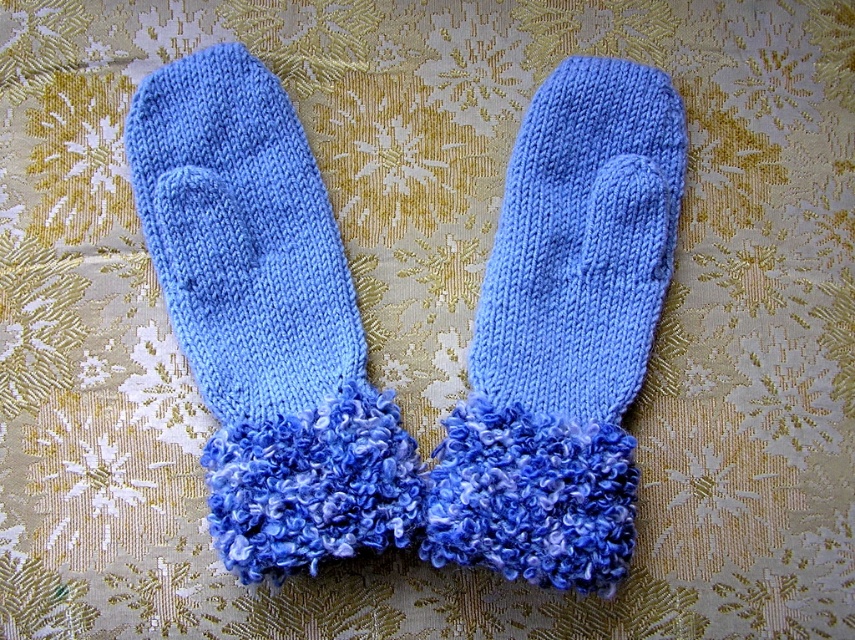
Question: Can you confirm if blue knitted sock at left is bigger than blue knitted mittens at center?

Choices:
 (A) yes
 (B) no

Answer: (A)

Question: Among these points, which one is farthest from the camera?

Choices:
 (A) (535, 256)
 (B) (346, 545)

Answer: (A)

Question: Does blue knitted sock at left appear under blue knitted mittens at center?

Choices:
 (A) no
 (B) yes

Answer: (A)

Question: Considering the relative positions of blue knitted sock at left and blue knitted mittens at center in the image provided, where is blue knitted sock at left located with respect to blue knitted mittens at center?

Choices:
 (A) right
 (B) left

Answer: (B)